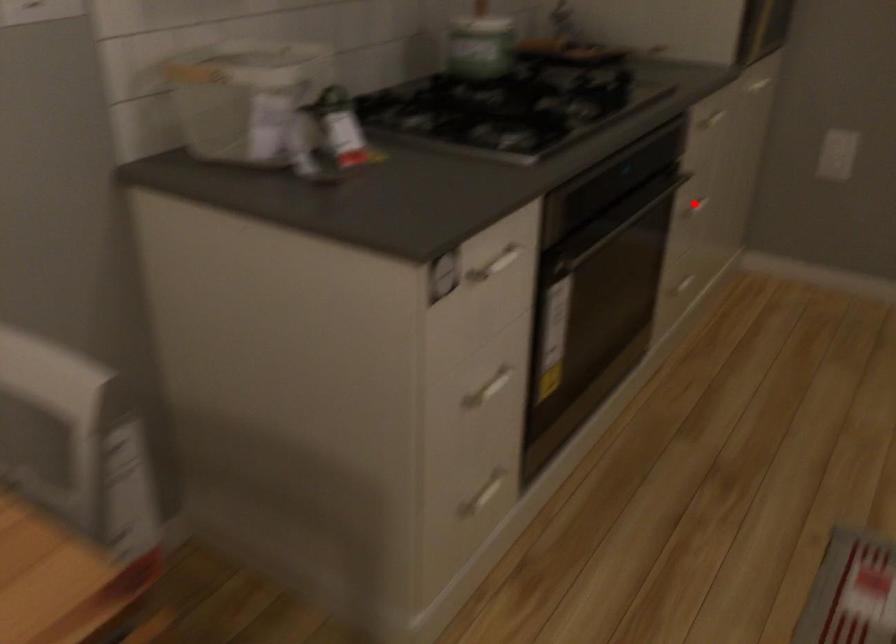
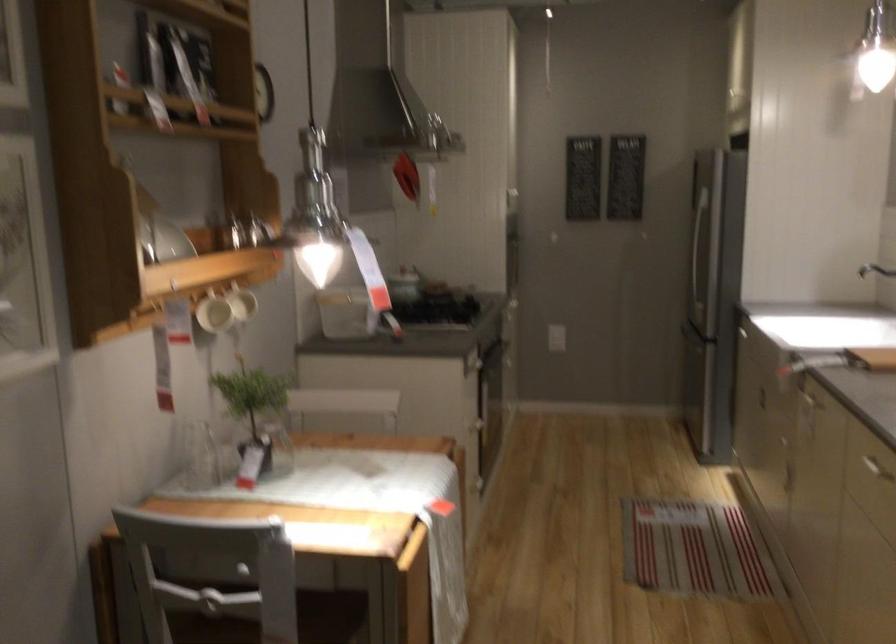
Question: I am providing you with two images of the same scene from different viewpoints. A red point is marked on the first image. Can you still see the location of the red point in image 2?

Choices:
 (A) Yes
 (B) No

Answer: (B)